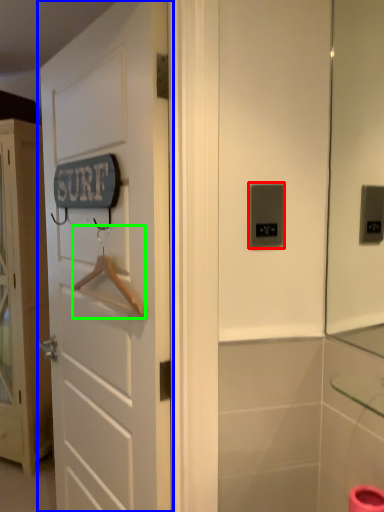
Question: Which object is the farthest from light switch (highlighted by a red box)? Choose among these: door (highlighted by a blue box) or hanger (highlighted by a green box).

Choices:
 (A) door
 (B) hanger

Answer: (A)